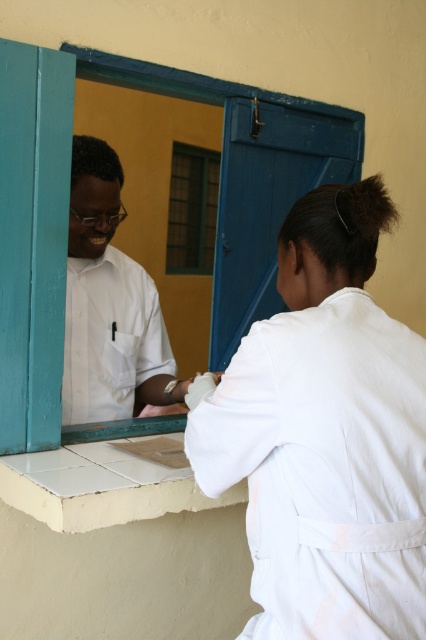
Question: Which of the following is the farthest from the observer?

Choices:
 (A) (235, 328)
 (B) (103, 369)
 (C) (282, 420)
 (D) (204, 259)

Answer: (D)

Question: Among these points, which one is farthest from the camera?

Choices:
 (A) (23, 93)
 (B) (400, 572)
 (C) (175, 192)

Answer: (C)

Question: Which point is farther to the camera?

Choices:
 (A) white cloth at right
 (B) yellow matte window at center

Answer: (B)

Question: Where is white shirt at left located in relation to yellow matte window at center in the image?

Choices:
 (A) right
 (B) left

Answer: (B)

Question: Does white cloth at right have a greater width compared to yellow matte window at center?

Choices:
 (A) no
 (B) yes

Answer: (B)

Question: Does teal wood window frame at upper center come behind yellow matte window at center?

Choices:
 (A) yes
 (B) no

Answer: (B)